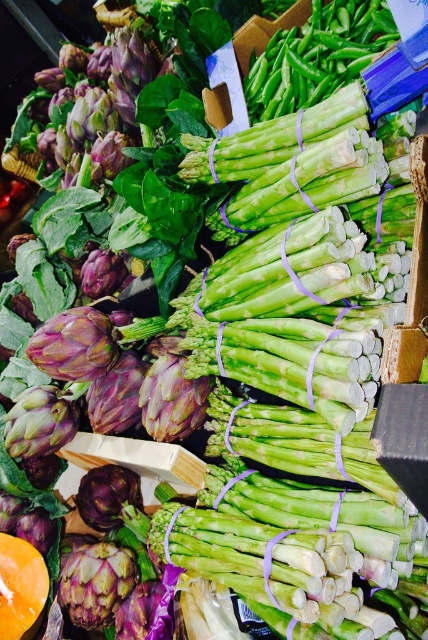
You are a customer at the market stall looking at the vegetables. You see a purple matte artichoke at center left. Where is the point at coordinate [97,582] located?

The point at coordinate [97,582] is located at the purple matte artichoke at center left.